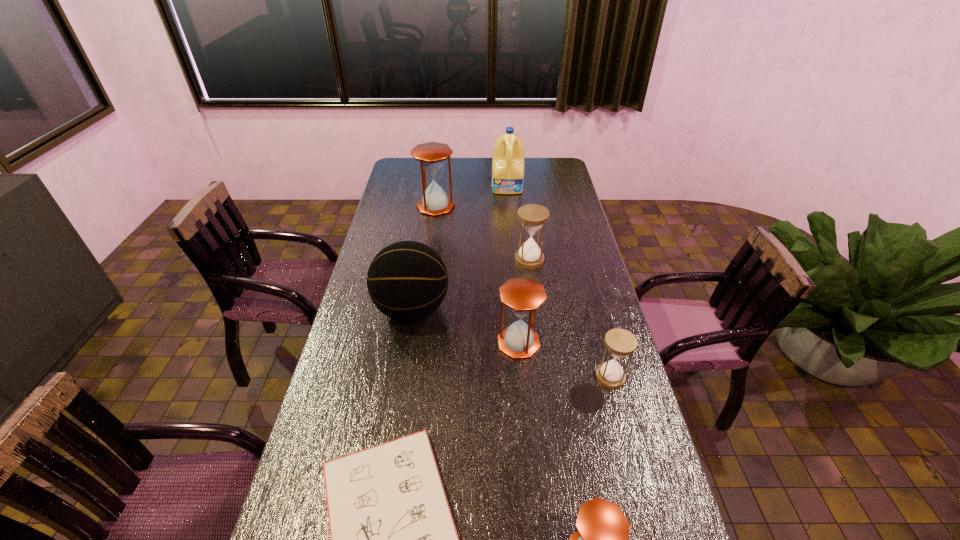
This screenshot has height=540, width=960. I want to click on vacant region at the far edge of the desktop, so click(x=528, y=161).

This screenshot has width=960, height=540. I want to click on vacant area at the left edge, so click(x=407, y=232).

In the image, there is a desktop. Identify the location of vacant space at the right edge. The width and height of the screenshot is (960, 540). (582, 306).

The image size is (960, 540). In the image, there is a desktop. Find the location of `free space at the far right corner`. free space at the far right corner is located at coordinates (558, 165).

At what (x,y) coordinates should I click in order to perform the action: click on empty location between the basketball and the third farthest hourglass. Please return your answer as a coordinate pair (x, y). Looking at the image, I should click on (466, 326).

Identify the location of free spot between the basketball and the second biggest brown hourglass. This screenshot has width=960, height=540. (466, 326).

I want to click on free space between the farthest object and the farthest hourglass, so click(471, 197).

Find the location of a particular element. Image resolution: width=960 pixels, height=540 pixels. object that is the third closest one to the second farthest brown hourglass is located at coordinates (393, 539).

Identify the location of the fourth closest object relative to the black basketball. The image size is (960, 540). (432, 155).

Select which hourglass appears as the fourth closest to the gray notepad. Please provide its 2D coordinates. Your answer should be formatted as a tuple, i.e. [(x, y)], where the tuple contains the x and y coordinates of a point satisfying the conditions above.

[(532, 216)]